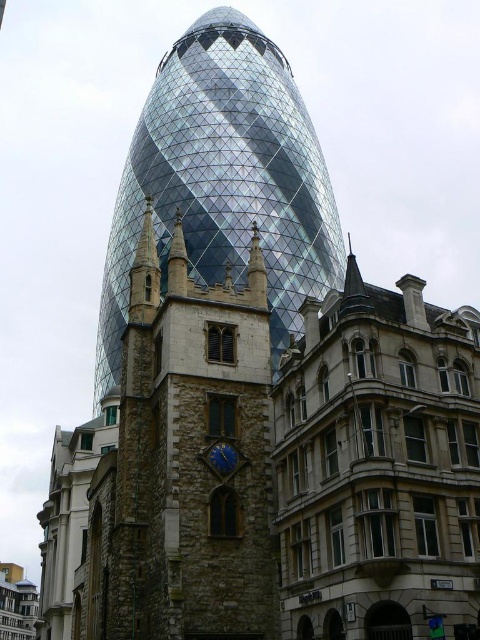
In the scene shown: You are standing at the point marked at coordinates point (192, 456). Which object in the scene is directly beneath you?

The point (192, 456) is on the stone clock tower at center left, so the stone clock tower at center left is directly beneath you.